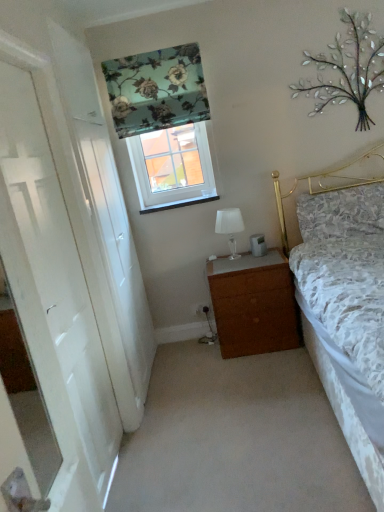
Image resolution: width=384 pixels, height=512 pixels. What are the coordinates of `blank area to the left of brown wood chest of drawers at center` in the screenshot? It's located at (192, 356).